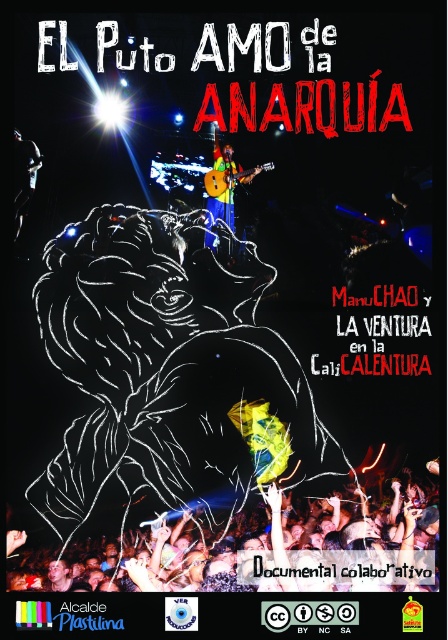
You are standing in front of the promotional poster for the documentary. There are two points marked on the poster at coordinates point (193, 572) and point (233, 179). Which point is closer to you?

Point (193, 572) is in front of point (233, 179), so the point closer to you is point (193, 572).

You are a photographer standing at the front of the venue where the live music event is taking place. You want to capture a photo of the matte black crowd at lower center. Given that your camera has a maximum focus range of 50 meters, will you be able to focus on the crowd without moving closer?

The matte black crowd at lower center is 52.61 meters away from the viewer. Since the camera can only focus up to 50 meters, you will not be able to focus on the matte black crowd at lower center without moving closer.

You are a photographer at the event and want to capture a photo that includes both the matte black crowd at lower center and the green fabric guitar at upper center. Based on their positions, which object should appear higher in the photo?

The green fabric guitar at upper center should appear higher in the photo since it is located above the matte black crowd at lower center.